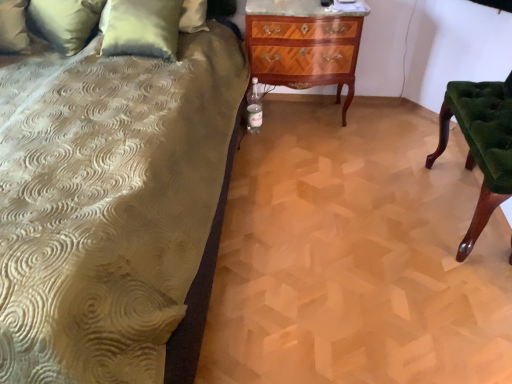
Find the location of a particular element. The height and width of the screenshot is (384, 512). free location to the left of green velvet chair at right is located at coordinates (359, 185).